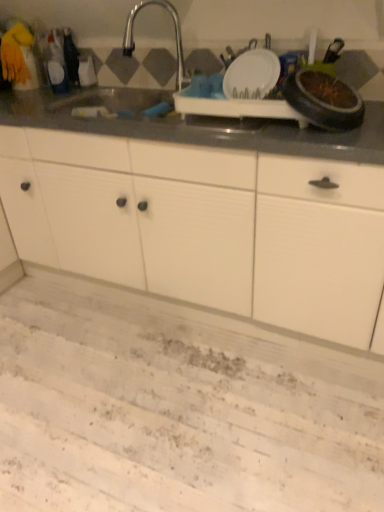
Describe the element at coordinates (204, 226) in the screenshot. The image size is (384, 512). I see `white matte cabinet at center` at that location.

Measure the distance between point [140,143] and camera.

Point [140,143] and camera are 5.15 feet apart from each other.

Locate an element on the screen. The image size is (384, 512). white matte cabinet at center is located at coordinates (204, 226).

I want to click on satin nickel faucet at upper center, so click(x=175, y=36).

The width and height of the screenshot is (384, 512). What do you see at coordinates (175, 36) in the screenshot?
I see `satin nickel faucet at upper center` at bounding box center [175, 36].

Find the location of a particular element. The width and height of the screenshot is (384, 512). white matte cabinet at center is located at coordinates (204, 226).

Is satin nickel faucet at upper center at the right side of white matte cabinet at center?

Incorrect, satin nickel faucet at upper center is not on the right side of white matte cabinet at center.

Is the position of satin nickel faucet at upper center more distant than that of white matte cabinet at center?

Yes, satin nickel faucet at upper center is behind white matte cabinet at center.

Which point is more distant from viewer, (179, 30) or (282, 327)?

The point (179, 30) is farther from the camera.

From the image's perspective, relative to white matte cabinet at center, is satin nickel faucet at upper center above or below?

Based on their image positions, satin nickel faucet at upper center is located above white matte cabinet at center.

From a real-world perspective, is satin nickel faucet at upper center physically above white matte cabinet at center?

Yes, from a real-world perspective, satin nickel faucet at upper center is above white matte cabinet at center.

Which of these two, satin nickel faucet at upper center or white matte cabinet at center, is thinner?

satin nickel faucet at upper center.

In the scene shown: Between satin nickel faucet at upper center and white matte cabinet at center, which one has less height?

satin nickel faucet at upper center.

Is satin nickel faucet at upper center smaller than white matte cabinet at center?

Yes, satin nickel faucet at upper center is smaller than white matte cabinet at center.

From the picture: Is satin nickel faucet at upper center spatially inside white matte cabinet at center, or outside of it?

satin nickel faucet at upper center is spatially situated outside white matte cabinet at center.

Are satin nickel faucet at upper center and white matte cabinet at center beside each other?

No, satin nickel faucet at upper center is not in contact with white matte cabinet at center.

Is satin nickel faucet at upper center positioned with its back to white matte cabinet at center?

No, white matte cabinet at center is not at the back of satin nickel faucet at upper center.

The width and height of the screenshot is (384, 512). Find the location of `tap located on the left of white matte cabinet at center`. tap located on the left of white matte cabinet at center is located at coordinates (175, 36).

Between white matte cabinet at center and satin nickel faucet at upper center, which one appears on the right side from the viewer's perspective?

white matte cabinet at center.

Is the position of white matte cabinet at center more distant than that of satin nickel faucet at upper center?

No, white matte cabinet at center is in front of satin nickel faucet at upper center.

Which is farther from the camera, (248, 312) or (181, 83)?

The point (181, 83) is more distant.

From the image's perspective, is white matte cabinet at center located beneath satin nickel faucet at upper center?

Yes.

Looking at this image, from a real-world perspective, who is located higher, white matte cabinet at center or satin nickel faucet at upper center?

From a 3D spatial view, satin nickel faucet at upper center is above.

Considering the sizes of objects white matte cabinet at center and satin nickel faucet at upper center in the image provided, who is thinner, white matte cabinet at center or satin nickel faucet at upper center?

With smaller width is satin nickel faucet at upper center.

Who is shorter, white matte cabinet at center or satin nickel faucet at upper center?

satin nickel faucet at upper center is shorter.

Considering the sizes of objects white matte cabinet at center and satin nickel faucet at upper center in the image provided, who is bigger, white matte cabinet at center or satin nickel faucet at upper center?

white matte cabinet at center.

Can we say white matte cabinet at center lies outside satin nickel faucet at upper center?

Yes, white matte cabinet at center is outside of satin nickel faucet at upper center.

Is white matte cabinet at center placed right next to satin nickel faucet at upper center?

white matte cabinet at center and satin nickel faucet at upper center are not in contact.

Based on the photo, could you tell me if white matte cabinet at center is turned towards satin nickel faucet at upper center?

No, white matte cabinet at center is not turned towards satin nickel faucet at upper center.

From the picture: How different are the orientations of white matte cabinet at center and satin nickel faucet at upper center in degrees?

The angular difference between white matte cabinet at center and satin nickel faucet at upper center is 1.58 degrees.

This screenshot has height=512, width=384. What are the coordinates of `tap positioned vertically above the white matte cabinet at center (from a real-world perspective)` in the screenshot? It's located at (175, 36).

Locate an element on the screen. The image size is (384, 512). tap located above the white matte cabinet at center (from a real-world perspective) is located at coordinates pos(175,36).

At what (x,y) coordinates should I click in order to perform the action: click on tap located above the white matte cabinet at center (from the image's perspective). Please return your answer as a coordinate pair (x, y). This screenshot has width=384, height=512. Looking at the image, I should click on (175, 36).